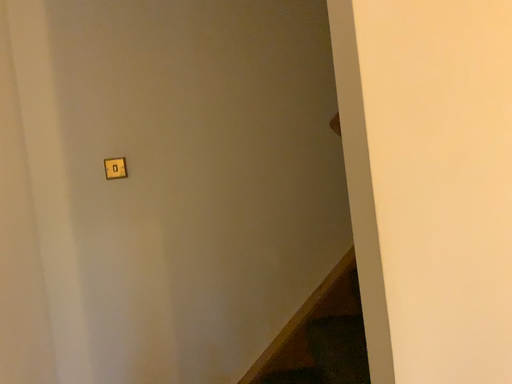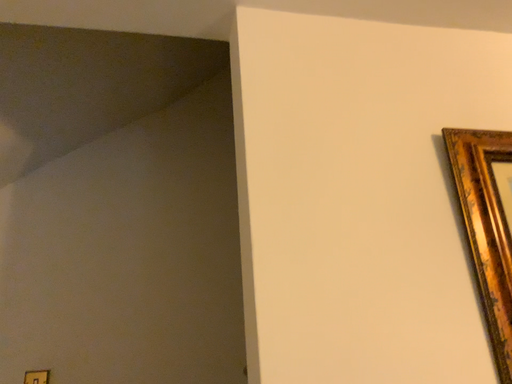
Question: Which way did the camera rotate in the video?

Choices:
 (A) rotated downward
 (B) rotated upward

Answer: (B)